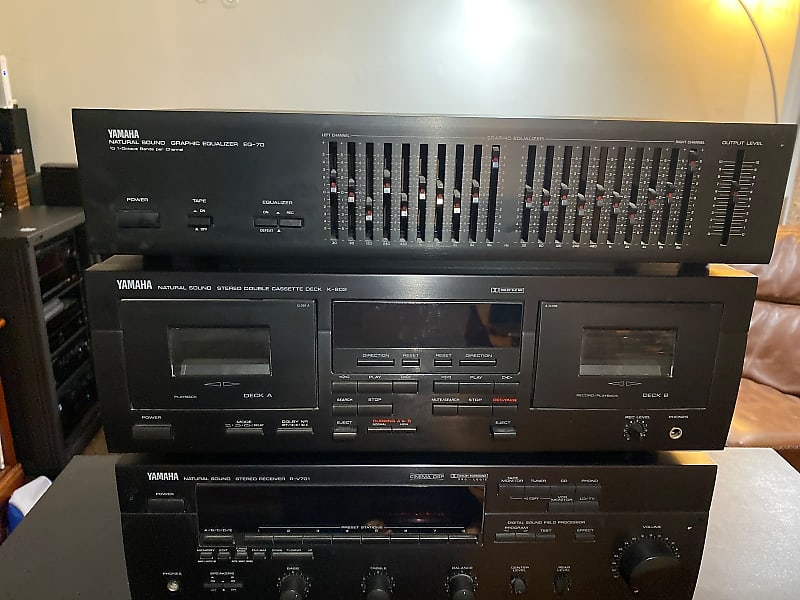
Locate an element on the screen. This screenshot has height=600, width=800. cassette player is located at coordinates (193, 369), (649, 358).